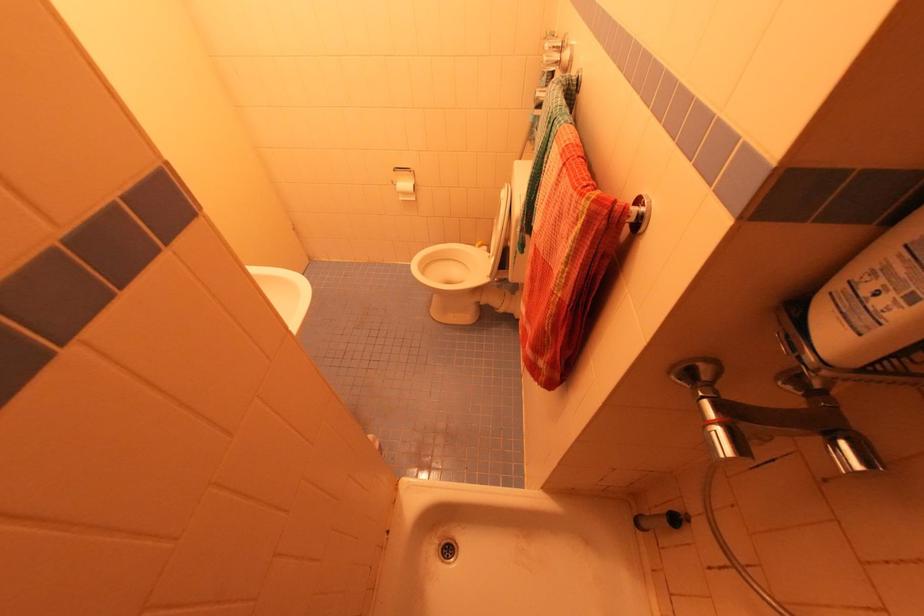
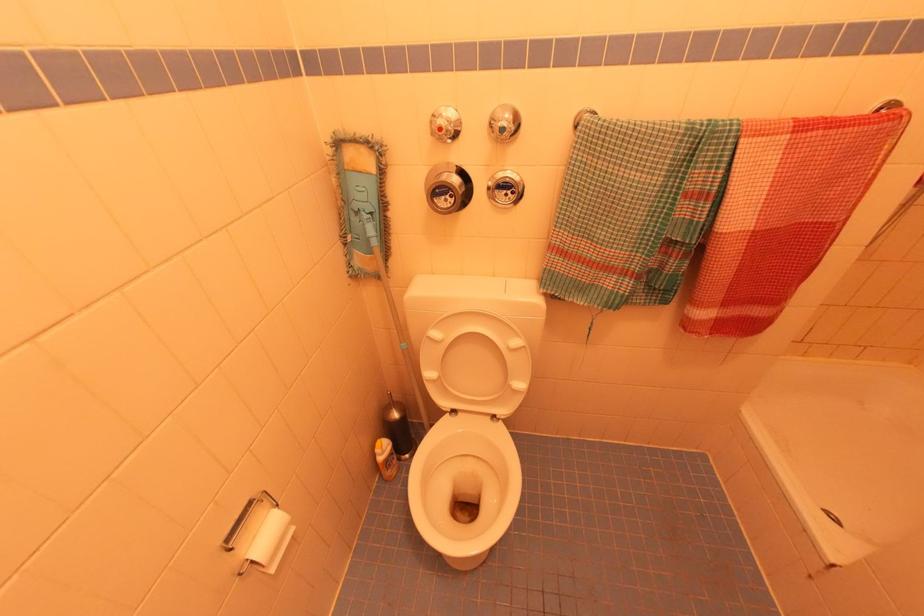
Find the pixel in the second image that matches point 482,249 in the first image.

(385, 448)